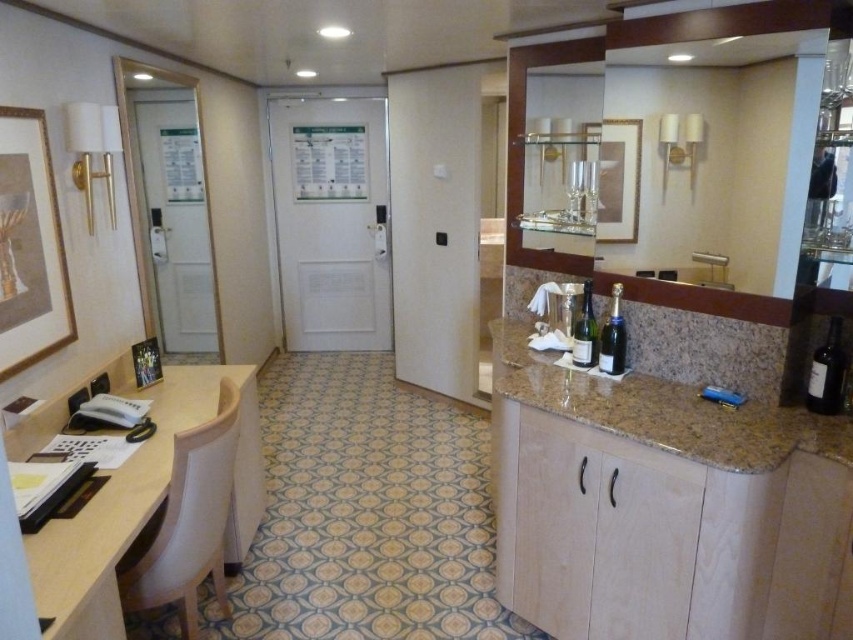
Which is above, granite countertop at right or brown granite sink at center?

brown granite sink at center is higher up.

Locate an element on the screen. The width and height of the screenshot is (853, 640). granite countertop at right is located at coordinates (665, 410).

Is sleek glass champagne bottle at center smaller than silver metallic faucet at center?

Actually, sleek glass champagne bottle at center might be larger than silver metallic faucet at center.

Who is positioned more to the left, sleek glass champagne bottle at center or silver metallic faucet at center?

sleek glass champagne bottle at center

Does point (587, 301) come closer to viewer compared to point (712, 257)?

No, (587, 301) is behind (712, 257).

What are the coordinates of `sleek glass champagne bottle at center` in the screenshot? It's located at (585, 330).

Is point (825, 369) farther from viewer compared to point (675, 280)?

No, it is in front of (675, 280).

Can you confirm if dark glass bottle at right is positioned to the right of brown granite sink at center?

Indeed, dark glass bottle at right is positioned on the right side of brown granite sink at center.

Who is more forward, (828, 364) or (727, 284)?

Point (828, 364) is in front.

You are a GUI agent. You are given a task and a screenshot of the screen. Output one action in this format:
    pyautogui.click(x=<x>, y=<y>)
    Task: Click on the dark glass bottle at right
    This screenshot has height=640, width=853.
    Given the screenshot: What is the action you would take?
    pyautogui.click(x=827, y=372)